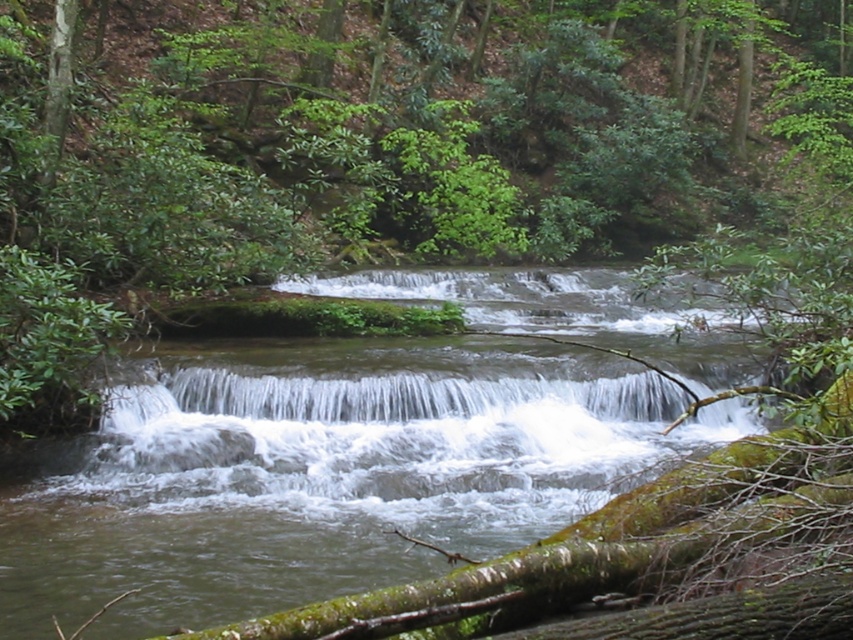
Question: Is clear water at center to the right of white frothy water at center from the viewer's perspective?

Choices:
 (A) no
 (B) yes

Answer: (B)

Question: Is clear water at center to the right of white frothy water at center from the viewer's perspective?

Choices:
 (A) yes
 (B) no

Answer: (A)

Question: Which of the following is the closest to the observer?

Choices:
 (A) white frothy water at center
 (B) clear water at center

Answer: (A)

Question: Does clear water at center lie in front of white frothy water at center?

Choices:
 (A) no
 (B) yes

Answer: (A)